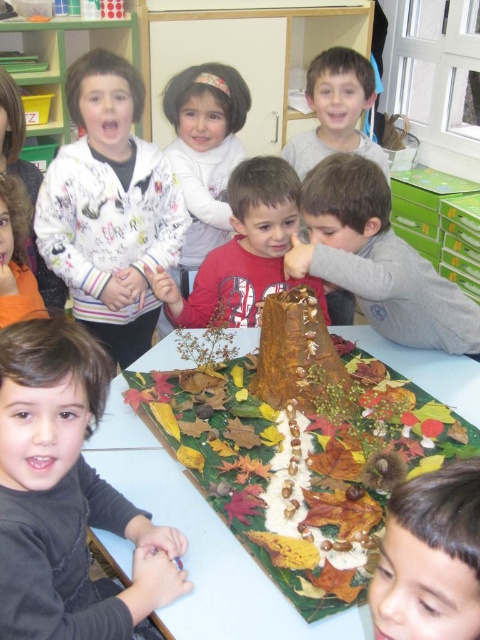
Question: Is brown textured paper at center below brown hair at lower right?

Choices:
 (A) yes
 (B) no

Answer: (A)

Question: Which point is farther to the camera?

Choices:
 (A) (108, 241)
 (B) (264, 296)

Answer: (A)

Question: Does brown textured tree trunk at center have a smaller size compared to white fluffy sweater at center?

Choices:
 (A) yes
 (B) no

Answer: (A)

Question: Which point is closer to the camera?

Choices:
 (A) (23, 312)
 (B) (314, 385)
 (C) (427, 493)
 (D) (351, 145)

Answer: (C)

Question: Is white printed sweater at upper left above brown hair at lower right?

Choices:
 (A) no
 (B) yes

Answer: (B)

Question: Which object is positioned closest to the brown hair at lower right?

Choices:
 (A) white printed sweater at upper left
 (B) chocolate cake at center
 (C) white fluffy sweater at center
 (D) brown textured paper at center

Answer: (D)